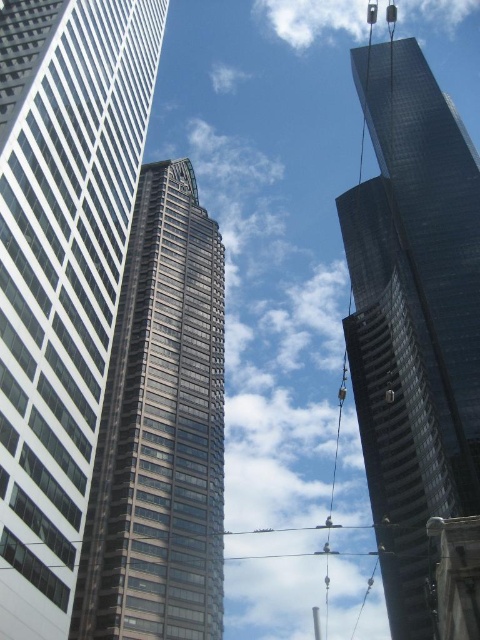
You are standing at the base of the glassy reflective skyscraper at center and want to walk towards the glossy glass skyscraper at upper right. Which direction should you face to move towards it?

You should face towards the upper right direction to move towards the glossy glass skyscraper at upper right since it is positioned further to the viewer compared to the glassy reflective skyscraper at center.

You are standing at the base of the three skyscrapers and want to take a photo that includes both the glossy glass skyscraper at upper right and the leftmost building. Based on their positions, which skyscraper should be positioned to the left in your photo?

The leftmost building should be positioned to the left in your photo since it is naturally located to the left of the glossy glass skyscraper at upper right.

You are standing on the sidewalk looking up at the three skyscrapers. Which one is positioned closer to you between the white glass skyscraper at left and the glassy reflective skyscraper at center?

The white glass skyscraper at left is closer to the viewer than the glassy reflective skyscraper at center.